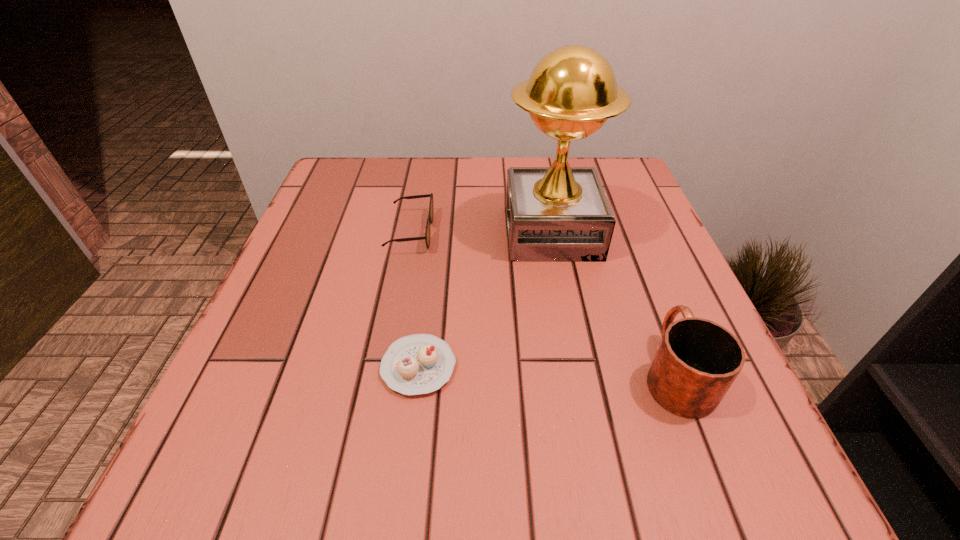
You are a GUI agent. You are given a task and a screenshot of the screen. Output one action in this format:
    pyautogui.click(x=<x>, y=<y>)
    Task: Click on the vacant space located 0.050m on the front-facing side of the third tallest object
    This screenshot has width=960, height=540.
    Given the screenshot: What is the action you would take?
    pyautogui.click(x=455, y=232)

Locate an element on the screen. vacant area located 0.110m on the right of the cupcake is located at coordinates (526, 367).

The width and height of the screenshot is (960, 540). Find the location of `object that is at the far edge`. object that is at the far edge is located at coordinates (560, 213).

Identify the location of award that is at the right edge. (560, 213).

Where is `mug present at the right edge`? The image size is (960, 540). mug present at the right edge is located at coordinates (697, 361).

Identify the location of object present at the far right corner. (560, 213).

You are a GUI agent. You are given a task and a screenshot of the screen. Output one action in this format:
    pyautogui.click(x=<x>, y=<y>)
    Task: Click on the free location at the far edge
    The image size is (960, 540).
    Given the screenshot: What is the action you would take?
    pyautogui.click(x=428, y=158)

You are a GUI agent. You are given a task and a screenshot of the screen. Output one action in this format:
    pyautogui.click(x=<x>, y=<y>)
    Task: Click on the vacant space at the near edge of the desktop
    The image size is (960, 540).
    Given the screenshot: What is the action you would take?
    pyautogui.click(x=599, y=467)

Identify the location of vacant space at the left edge of the desktop. Image resolution: width=960 pixels, height=540 pixels. pyautogui.click(x=228, y=383).

Where is `free location at the right edge`? free location at the right edge is located at coordinates (621, 226).